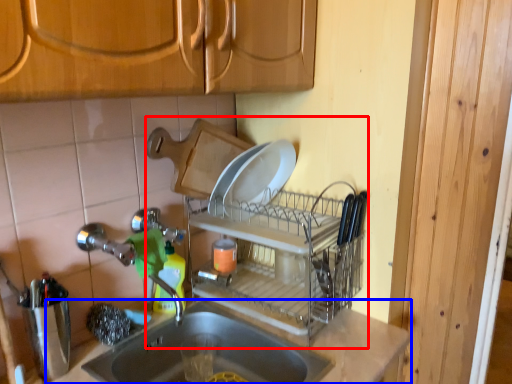
Question: Which object is further to the camera taking this photo, dish washer (highlighted by a red box) or countertop (highlighted by a blue box)?

Choices:
 (A) dish washer
 (B) countertop

Answer: (A)